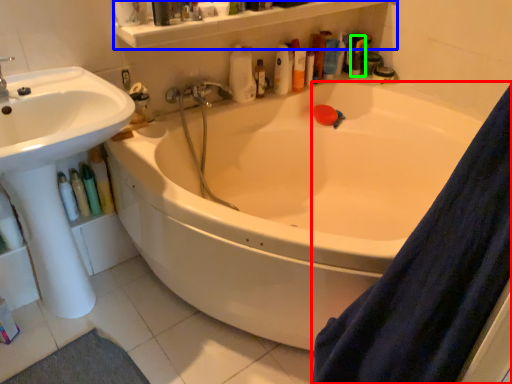
Question: Which is nearer to the shower curtain (highlighted by a red box)? balustrade (highlighted by a blue box) or toiletry (highlighted by a green box).

Choices:
 (A) balustrade
 (B) toiletry

Answer: (A)